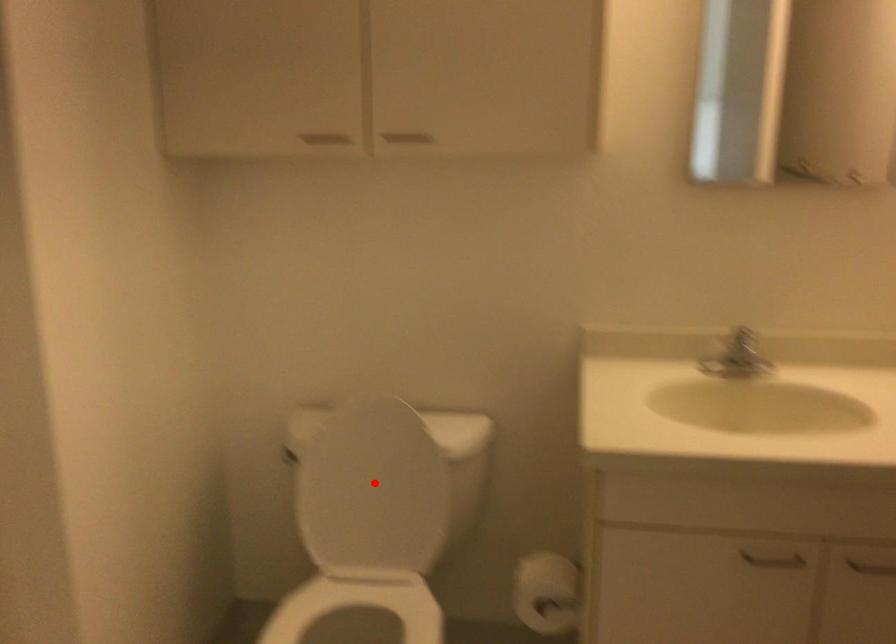
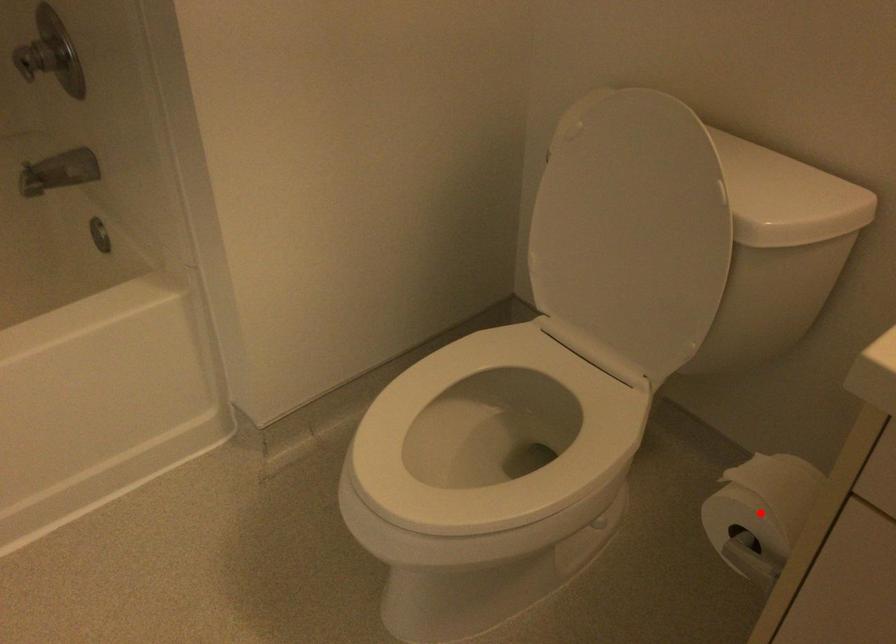
I am providing you with two images of the same scene from different viewpoints. A red point is marked on the first image and another point is marked on the second image. Does the point marked in image1 correspond to the same location as the one in image2?

No